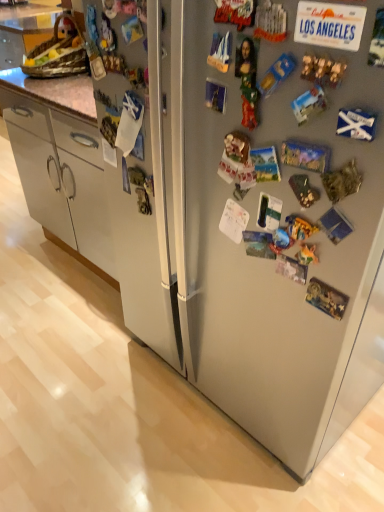
Question: In terms of height, does satin silver refrigerator at center look taller or shorter compared to wooden basket at upper left?

Choices:
 (A) tall
 (B) short

Answer: (B)

Question: Considering the positions of satin silver refrigerator at center and wooden basket at upper left in the image, is satin silver refrigerator at center bigger or smaller than wooden basket at upper left?

Choices:
 (A) big
 (B) small

Answer: (A)

Question: Does point (276, 125) appear closer or farther from the camera than point (18, 18)?

Choices:
 (A) closer
 (B) farther

Answer: (A)

Question: Looking at their shapes, would you say wooden basket at upper left is wider or thinner than satin silver refrigerator at center?

Choices:
 (A) wide
 (B) thin

Answer: (B)

Question: Looking at the image, does wooden basket at upper left seem bigger or smaller compared to satin silver refrigerator at center?

Choices:
 (A) big
 (B) small

Answer: (B)

Question: From their relative heights in the image, would you say wooden basket at upper left is taller or shorter than satin silver refrigerator at center?

Choices:
 (A) short
 (B) tall

Answer: (B)

Question: Would you say wooden basket at upper left is to the left or to the right of satin silver refrigerator at center in the picture?

Choices:
 (A) right
 (B) left

Answer: (A)